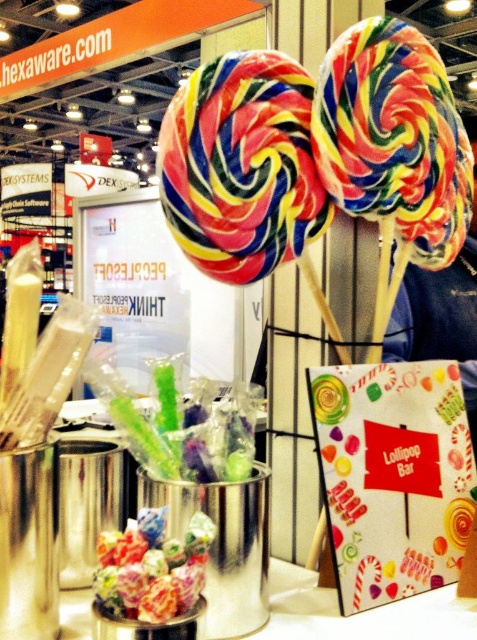
You are standing at the entrance of the exhibition and see two points in the image. The first point is at coordinates point (341, 161) and the second is at point (110, 536). Which point is closer to you?

Point (341, 161) is further to the camera than point (110, 536), so the second point is closer to you.

Based on the photo, you are at a trade show and see the multicolored spiral lollipop at center and the swirled sugar lollipop at center. Which one is positioned lower in the image?

The multicolored spiral lollipop at center is located below the swirled sugar lollipop at center, so it is positioned lower in the image.